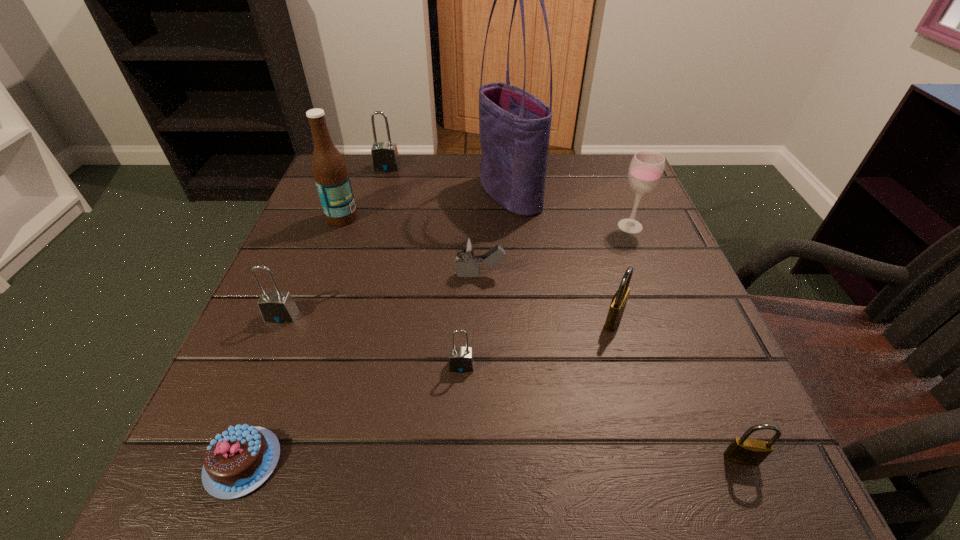
Where is `the sixth nearest object`? This screenshot has height=540, width=960. the sixth nearest object is located at coordinates pyautogui.click(x=467, y=248).

Identify the location of gray igniter. (467, 248).

Identify the location of the smallest gray padlock. (461, 360).

Identify the location of the nearest gray padlock. This screenshot has height=540, width=960. (461, 360).

Where is `the right brass padlock`? This screenshot has width=960, height=540. the right brass padlock is located at coordinates (746, 451).

The image size is (960, 540). Find the location of `the rightmost padlock`. the rightmost padlock is located at coordinates (746, 451).

You are a GUI agent. You are given a task and a screenshot of the screen. Output one action in this format:
    pyautogui.click(x=<x>, y=<y>)
    Task: Click on the shortest object
    The height and width of the screenshot is (540, 960).
    Given the screenshot: What is the action you would take?
    pyautogui.click(x=237, y=461)

Locate an element on the screen. This screenshot has width=960, height=540. pink chocolate cake is located at coordinates (237, 461).

Find the location of `vacant region located 0.310m on the front of the tote bag`. vacant region located 0.310m on the front of the tote bag is located at coordinates (520, 326).

Identify the location of vacant space located on the front of the beer bottle. The image size is (960, 540). coord(324,268).